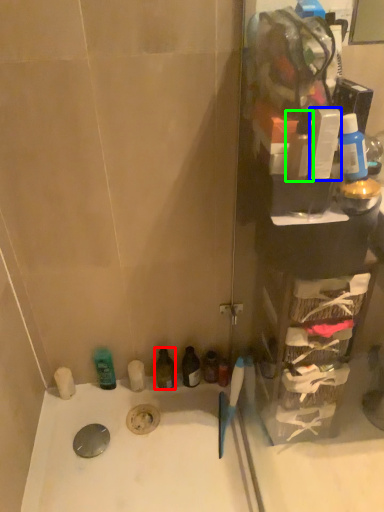
Question: Based on their relative distances, which object is nearer to mouthwash (highlighted by a red box)? Choose from toiletry (highlighted by a blue box) and mouthwash (highlighted by a green box).

Choices:
 (A) toiletry
 (B) mouthwash

Answer: (B)